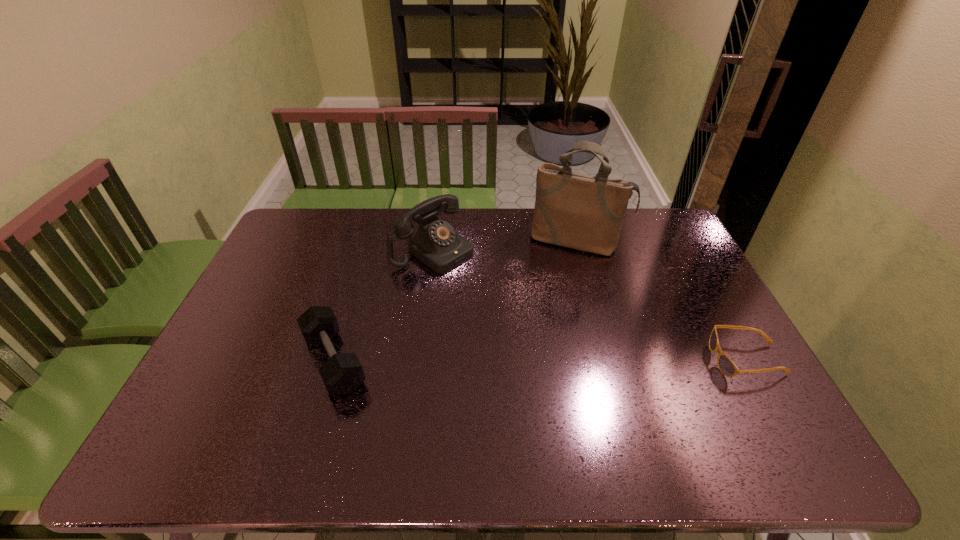
In the image, there is a desktop. At what (x,y) coordinates should I click in order to perform the action: click on free space at the far edge. Please return your answer as a coordinate pair (x, y). Looking at the image, I should click on (415, 231).

This screenshot has height=540, width=960. I want to click on vacant space at the near edge of the desktop, so click(508, 395).

Find the location of `free point at the left edge`. free point at the left edge is located at coordinates click(x=264, y=287).

Find the location of `vacant space at the right edge of the desktop`. vacant space at the right edge of the desktop is located at coordinates click(694, 295).

At what (x,y) coordinates should I click in order to perform the action: click on free space at the far left corner of the desktop. Please return your answer as a coordinate pair (x, y). Looking at the image, I should click on (291, 237).

Where is `blank space at the far right corner of the desktop`? blank space at the far right corner of the desktop is located at coordinates (650, 212).

In the image, there is a desktop. Identify the location of free space at the near right corner. (739, 407).

Locate an element on the screen. The height and width of the screenshot is (540, 960). empty location between the rightmost object and the second tallest object is located at coordinates (590, 305).

Locate an element on the screen. The width and height of the screenshot is (960, 540). free area in between the shortest object and the dumbbell is located at coordinates (540, 360).

Find the location of a particular element. Image resolution: width=960 pixels, height=540 pixels. vacant space in between the rightmost object and the second shortest object is located at coordinates (540, 360).